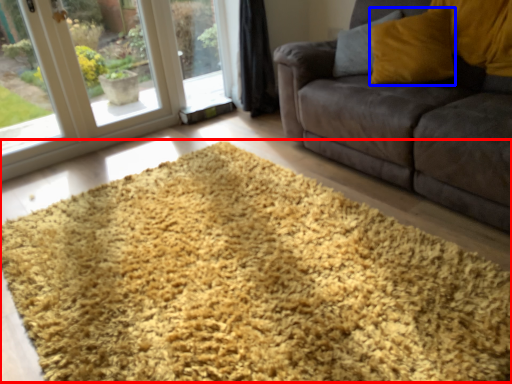
Question: Among these objects, which one is nearest to the camera, hay (highlighted by a red box) or throw pillow (highlighted by a blue box)?

Choices:
 (A) hay
 (B) throw pillow

Answer: (A)